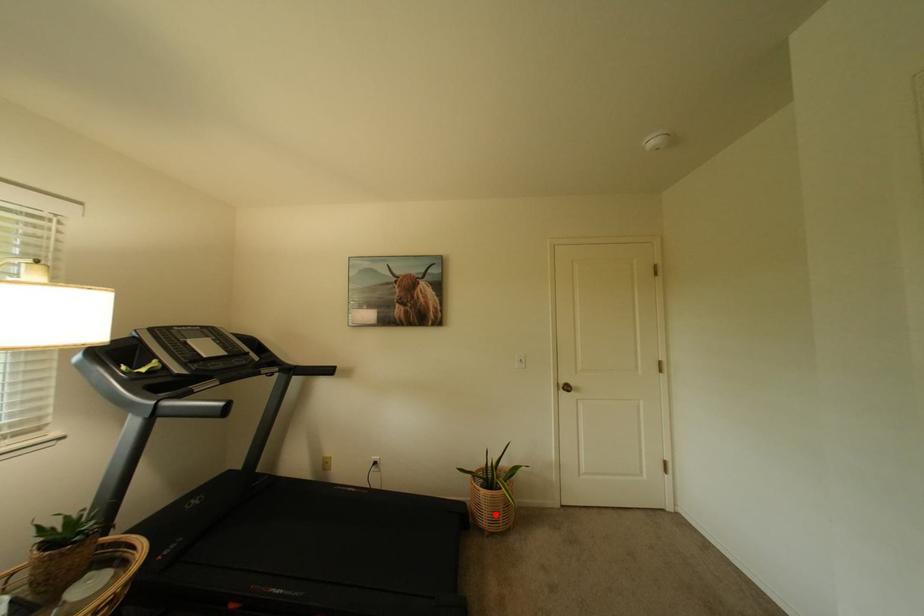
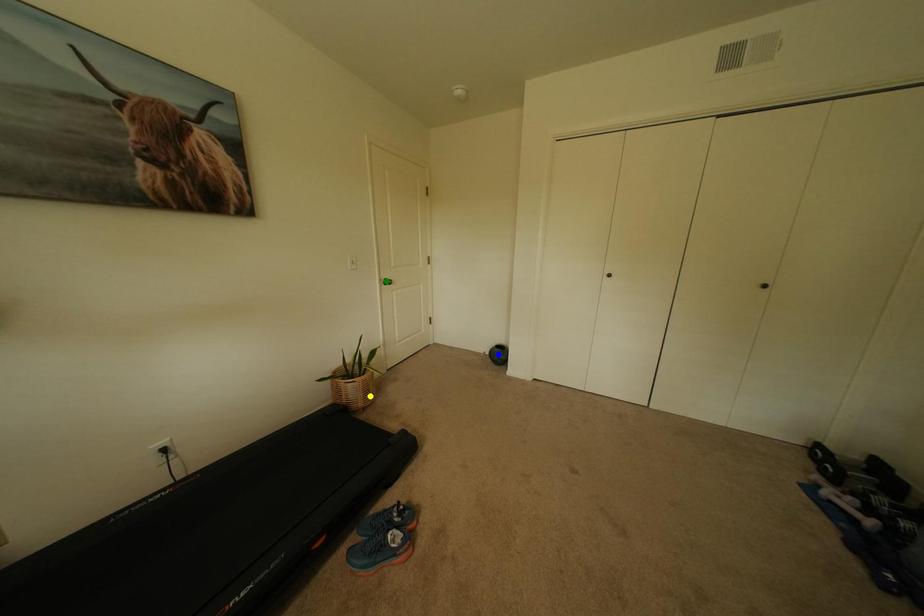
Question: I am providing you with two images of the same scene from different viewpoints. A red point is marked on the first image. You are given multiple points on the second image. In image 2, which mark is for the same physical point as the one in image 1?

Choices:
 (A) yellow point
 (B) green point
 (C) blue point

Answer: (A)